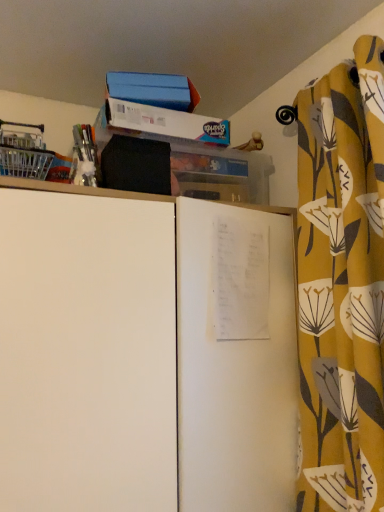
Question: From a real-world perspective, does yellow floral fabric curtain at right stand above white matte cabinet at center?

Choices:
 (A) yes
 (B) no

Answer: (A)

Question: Is white matte cabinet at center at the back of yellow floral fabric curtain at right?

Choices:
 (A) yes
 (B) no

Answer: (B)

Question: Is yellow floral fabric curtain at right positioned far away from white matte cabinet at center?

Choices:
 (A) yes
 (B) no

Answer: (B)

Question: From the image's perspective, is yellow floral fabric curtain at right beneath white matte cabinet at center?

Choices:
 (A) no
 (B) yes

Answer: (A)

Question: Can you confirm if yellow floral fabric curtain at right is shorter than white matte cabinet at center?

Choices:
 (A) yes
 (B) no

Answer: (B)

Question: Is yellow floral fabric curtain at right in contact with white matte cabinet at center?

Choices:
 (A) yes
 (B) no

Answer: (B)

Question: Can you confirm if white matte cabinet at center is thinner than yellow floral fabric curtain at right?

Choices:
 (A) no
 (B) yes

Answer: (A)

Question: Does white matte cabinet at center have a greater height compared to yellow floral fabric curtain at right?

Choices:
 (A) no
 (B) yes

Answer: (A)

Question: Does white matte cabinet at center appear on the left side of yellow floral fabric curtain at right?

Choices:
 (A) yes
 (B) no

Answer: (A)

Question: Is white matte cabinet at center further to the viewer compared to yellow floral fabric curtain at right?

Choices:
 (A) no
 (B) yes

Answer: (A)

Question: From the image's perspective, is white matte cabinet at center over yellow floral fabric curtain at right?

Choices:
 (A) no
 (B) yes

Answer: (A)

Question: Is white matte cabinet at center beside yellow floral fabric curtain at right?

Choices:
 (A) yes
 (B) no

Answer: (B)

Question: Looking at their shapes, would you say white matte cabinet at center is wider or thinner than yellow floral fabric curtain at right?

Choices:
 (A) thin
 (B) wide

Answer: (B)